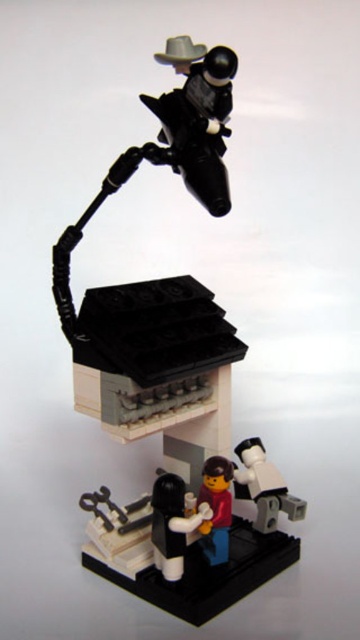
Between point (186, 497) and point (227, 490), which one is positioned behind?

Positioned behind is point (227, 490).

Based on the photo, which is more to the left, black plastic microphone at upper center or smooth plastic cup at lower center?

black plastic microphone at upper center is more to the left.

This screenshot has width=360, height=640. I want to click on black plastic microphone at upper center, so click(x=162, y=289).

The height and width of the screenshot is (640, 360). Find the location of `black plastic microphone at upper center`. black plastic microphone at upper center is located at coordinates (162, 289).

From the picture: Can you confirm if matte black coffee cup at lower center is taller than smooth plastic cup at lower center?

In fact, matte black coffee cup at lower center may be shorter than smooth plastic cup at lower center.

Does matte black coffee cup at lower center have a lesser height compared to smooth plastic cup at lower center?

Yes.

Does point (160, 492) come farther from viewer compared to point (200, 540)?

No, it is not.

Where is `matte black coffee cup at lower center`? The image size is (360, 640). matte black coffee cup at lower center is located at coordinates (173, 524).

Between black plastic microphone at upper center and matte black coffee cup at lower center, which one appears on the right side from the viewer's perspective?

black plastic microphone at upper center is more to the right.

Describe the element at coordinates (162, 289) in the screenshot. This screenshot has width=360, height=640. I see `black plastic microphone at upper center` at that location.

Locate an element on the screen. The height and width of the screenshot is (640, 360). black plastic microphone at upper center is located at coordinates (162, 289).